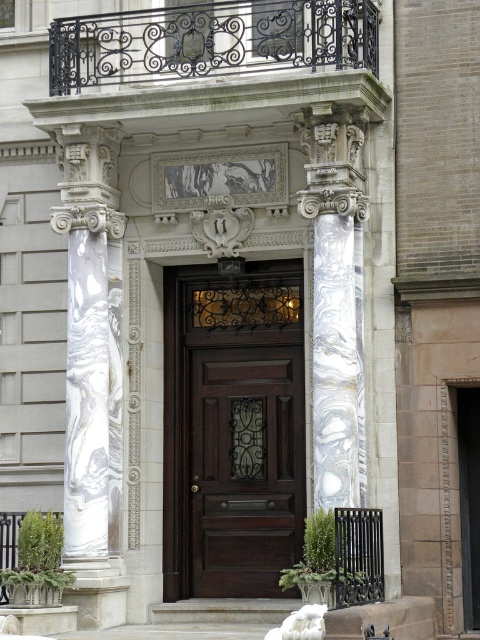
You are standing at the entrance of a building and want to locate the dark wood door at center. Can you tell me its coordinates in the image?

The dark wood door at center is located at coordinates point (244, 468).

Consider the image. You are standing at the entrance of the building and want to go upstairs. Which object should you approach first, the dark wood door at center or the white marble stairs at center?

You should approach the dark wood door at center first because it is closer to you than the white marble stairs at center.